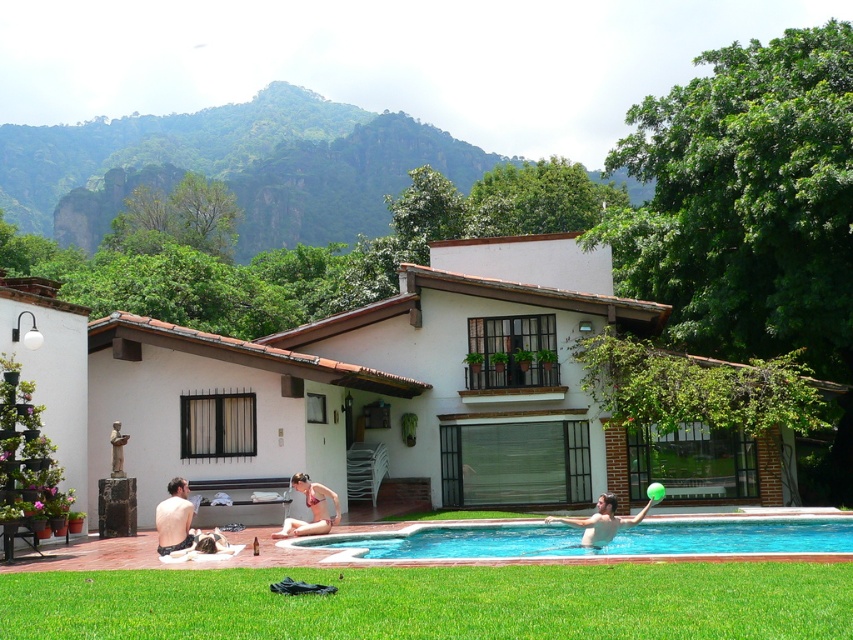
Question: Is shiny black swimwear at lower left smaller than smooth green ball at lower center?

Choices:
 (A) yes
 (B) no

Answer: (B)

Question: Is white stucco villa at center smaller than beige bikini at lower center?

Choices:
 (A) yes
 (B) no

Answer: (B)

Question: Among these points, which one is nearest to the camera?

Choices:
 (A) (183, 468)
 (B) (160, 520)

Answer: (B)

Question: Among these objects, which one is farthest from the camera?

Choices:
 (A) beige bikini at lower center
 (B) smooth green ball at lower center
 (C) shiny black swimwear at lower left

Answer: (A)

Question: Is blue glossy water at lower center to the right of smooth green ball at lower center from the viewer's perspective?

Choices:
 (A) no
 (B) yes

Answer: (B)

Question: Which point is closer to the camera?

Choices:
 (A) [x=524, y=412]
 (B) [x=296, y=524]
 (C) [x=595, y=515]

Answer: (C)